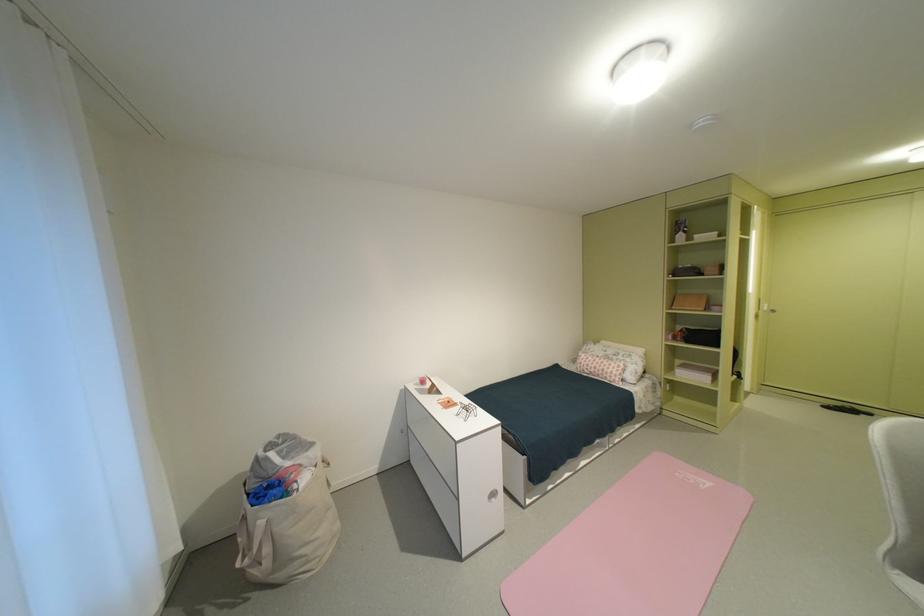
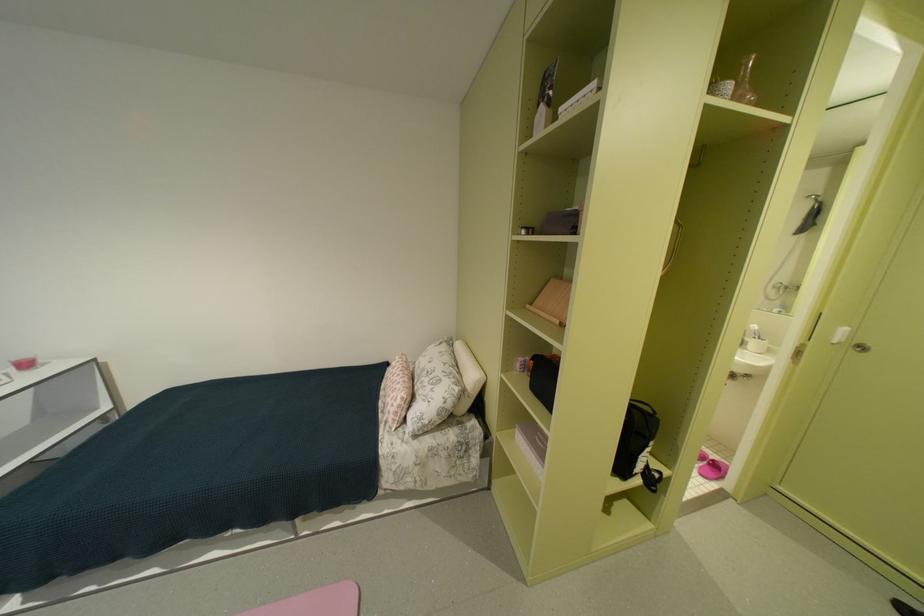
What movement of the cameraman would produce the second image?

The movement direction of the cameraman is right, forward.